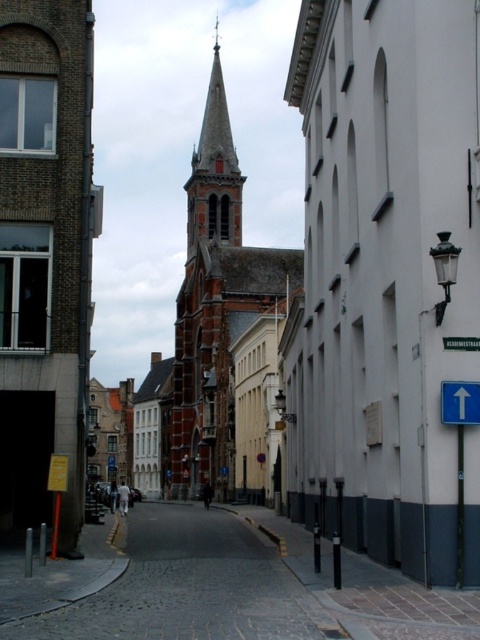
You are standing on the street in front of the smooth white church at center. You want to take a photo of the church with your phone, which has a maximum focus range of 30 meters. Will your phone be able to focus on the church?

The smooth white church at center and viewer are 34.97 meters apart from each other. Since the phone has a maximum focus range of 30 meters, it cannot focus on the church because the distance exceeds the limit.